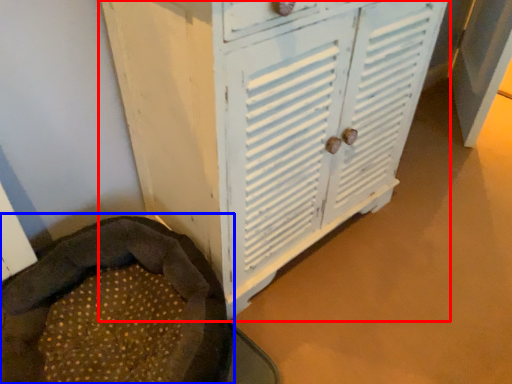
Question: Which point is further to the camera, cupboard (highlighted by a red box) or bean bag chair (highlighted by a blue box)?

Choices:
 (A) cupboard
 (B) bean bag chair

Answer: (B)